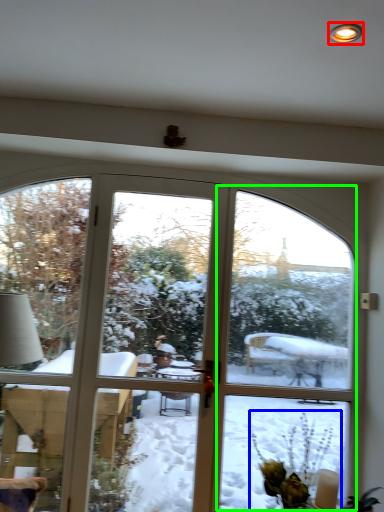
Question: Which object is positioned closest to light (highlighted by a red box)? Select from floral arrangement (highlighted by a blue box) and screen door (highlighted by a green box).

Choices:
 (A) floral arrangement
 (B) screen door

Answer: (A)